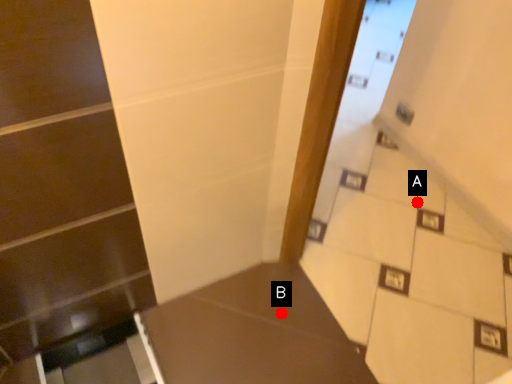
Question: Two points are circled on the image, labeled by A and B beside each circle. Which point is closer to the camera taking this photo?

Choices:
 (A) A is closer
 (B) B is closer

Answer: (B)